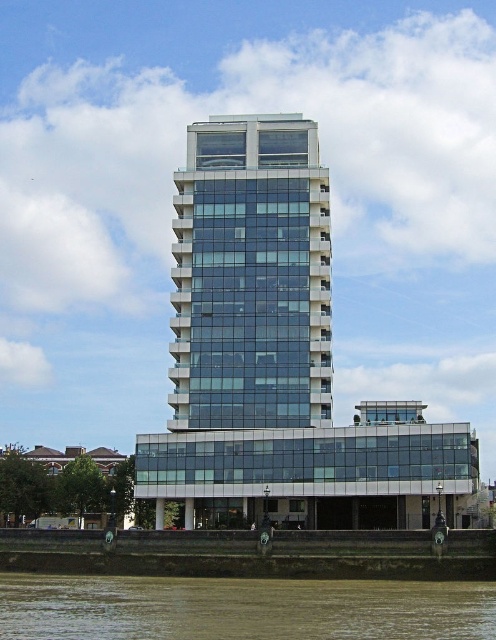
From the picture: You are standing on the concrete embankment next to the waterfront. You see a point marked at coordinates (251, 276). Is this point located on the transparent glass building at center?

Yes, the point (251, 276) is on the transparent glass building at center.

Based on the scene description, where is the transparent glass building at center located in the image? Please provide the coordinates in the format of a point with two decimal places.

The transparent glass building at center is located at point coordinates of (251, 276).

You are standing at the center of the waterfront embankment, directly facing the clear glass building at center. If you walk straight ahead, will you reach the building before the edge of the embankment?

The clear glass building at center is located at point (276, 356). Since you are at the center of the embankment, which is presumably along the edge, the building is positioned further inland. Walking straight ahead towards the building would lead you to it before reaching the embankment edge, which is behind you. However, this depends on the embankment layout. Without specific distance data, we can infer based on coordinates that the building is centrally located, so yes, you would reach it before the em